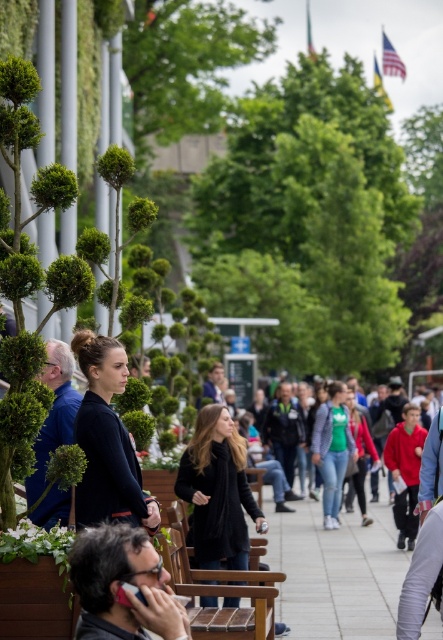
Question: Which point is closer to the camera?

Choices:
 (A) (53, 340)
 (B) (408, 536)
 (C) (101, 449)

Answer: (C)

Question: Which point is farther to the camera?

Choices:
 (A) (101, 467)
 (B) (319, 442)
 (C) (400, 424)

Answer: (B)

Question: Which point appears closest to the camera in this image?

Choices:
 (A) (327, 474)
 (B) (90, 609)
 (C) (404, 435)
 (D) (89, 518)

Answer: (B)

Question: In this image, where is black matte jacket at center located relative to matte black jacket at left?

Choices:
 (A) below
 (B) above

Answer: (B)

Question: Does matte black jacket at left have a larger size compared to green fabric jacket at center?

Choices:
 (A) no
 (B) yes

Answer: (A)

Question: Does matte black phone at lower left appear under matte black jacket at left?

Choices:
 (A) yes
 (B) no

Answer: (A)